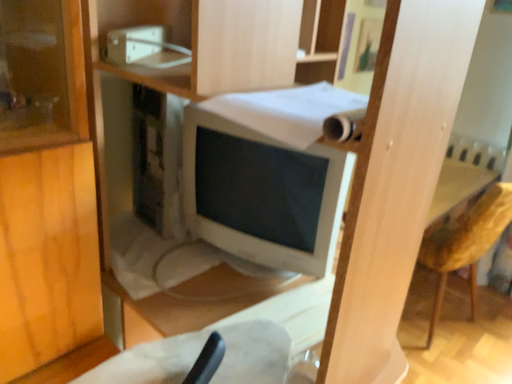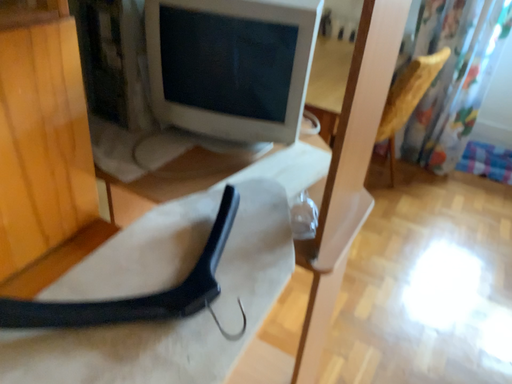
Question: Which way did the camera rotate in the video?

Choices:
 (A) rotated downward
 (B) rotated upward

Answer: (A)